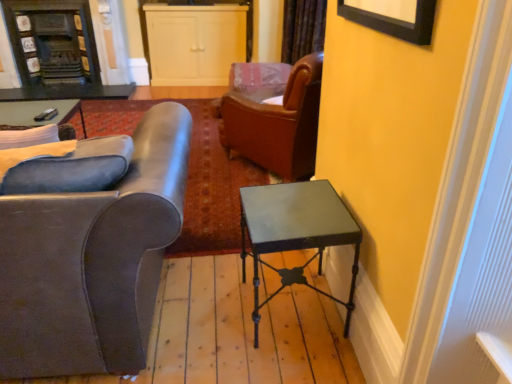
Question: Relative to metallic green table at right, is white matte cabinet at upper center, the second cabinetry when ordered from left to right, in front or behind?

Choices:
 (A) front
 (B) behind

Answer: (B)

Question: Is white matte cabinet at upper center, arranged as the 1th cabinetry when viewed from the right, spatially inside metallic green table at right, or outside of it?

Choices:
 (A) outside
 (B) inside

Answer: (A)

Question: Considering the real-world distances, which object is closest to the dark gray stone fireplace at upper left?

Choices:
 (A) white matte cabinet at upper center, arranged as the 1th cabinetry when viewed from the right
 (B) metallic green table at right
 (C) matte gray leather armchair at left
 (D) velvet brown curtain at upper center
 (E) dark wood fireplace at upper left, placed as the second cabinetry when sorted from right to left

Answer: (E)

Question: Which of these objects is positioned closest to the dark wood fireplace at upper left, which is counted as the first cabinetry, starting from the left?

Choices:
 (A) matte black remote control at upper left
 (B) velvet brown curtain at upper center
 (C) metallic green table at right
 (D) white matte cabinet at upper center, the second cabinetry when ordered from left to right
 (E) matte gray leather armchair at left

Answer: (D)